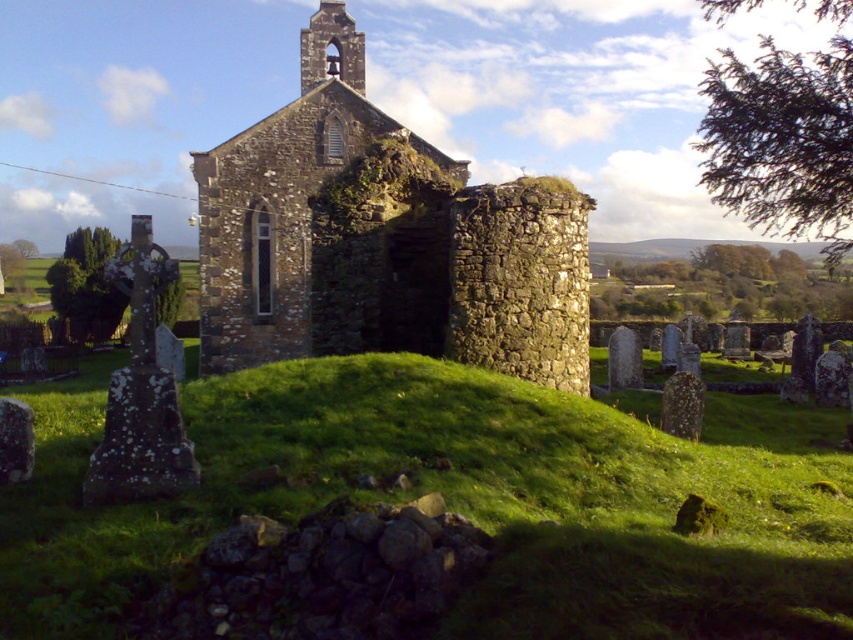
You are a gardener planning to plant flowers on the green grassy mound at center and the rustic stone church at center. Which location has more space for planting?

The rustic stone church at center has more space for planting since it is larger than the green grassy mound at center.

You are a gardener who needs to mow the green grassy mound at center and the rustic stone church at center. If your lawnmower has a 8 meter range from your starting point, which area can you reach?

The green grassy mound at center is 7.72 meters from rustic stone church at center. Since the lawnmower has an 8 meter range, you can reach both areas as the distance between them is within the range.

You are standing in front of the old stone church and want to place a small flowerpot at point (173, 541) and another flowerpot at point (488, 188). Which flowerpot will appear larger in the image?

The flowerpot placed at point (173, 541) will appear larger because it is closer to the camera than the flowerpot at point (488, 188).